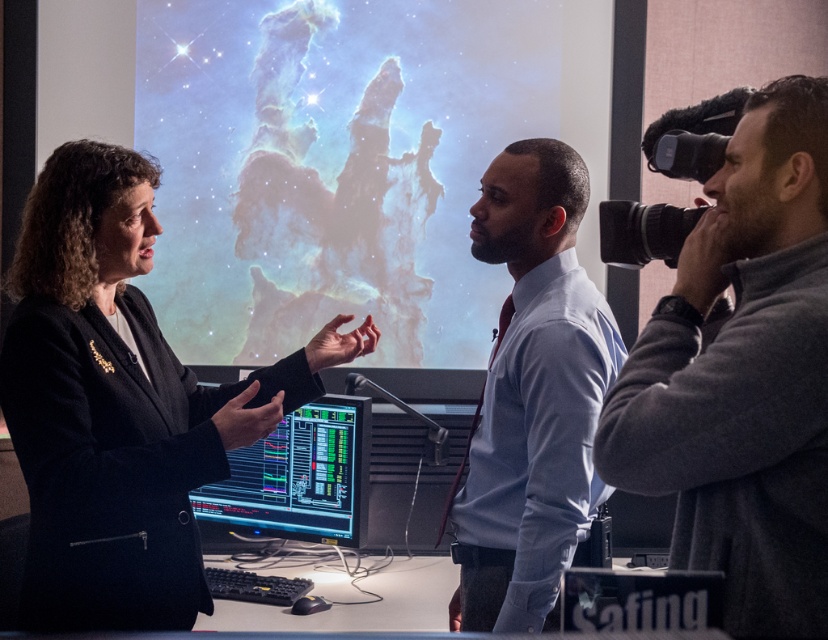
Can you confirm if gray fleece jacket at right is smaller than light blue shirt at center?

Correct, gray fleece jacket at right occupies less space than light blue shirt at center.

Does gray fleece jacket at right lie behind light blue shirt at center?

No, gray fleece jacket at right is closer to the viewer.

You are a GUI agent. You are given a task and a screenshot of the screen. Output one action in this format:
    pyautogui.click(x=<x>, y=<y>)
    Task: Click on the gray fleece jacket at right
    The height and width of the screenshot is (640, 828).
    Given the screenshot: What is the action you would take?
    pyautogui.click(x=742, y=376)

Is point (485, 477) positioned after point (292, 445)?

That is False.

Can you confirm if light blue shirt at center is shorter than shiny black monitor at center?

In fact, light blue shirt at center may be taller than shiny black monitor at center.

The image size is (828, 640). Identify the location of light blue shirt at center. (532, 396).

Locate an element on the screen. Image resolution: width=828 pixels, height=640 pixels. light blue shirt at center is located at coordinates (532, 396).

Does gray fleece jacket at right have a greater height compared to shiny black monitor at center?

Indeed, gray fleece jacket at right has a greater height compared to shiny black monitor at center.

Is gray fleece jacket at right to the right of shiny black monitor at center from the viewer's perspective?

Correct, you'll find gray fleece jacket at right to the right of shiny black monitor at center.

Does point (822, 129) lie behind point (304, 410)?

No, it is in front of (304, 410).

Locate an element on the screen. This screenshot has height=640, width=828. gray fleece jacket at right is located at coordinates (742, 376).